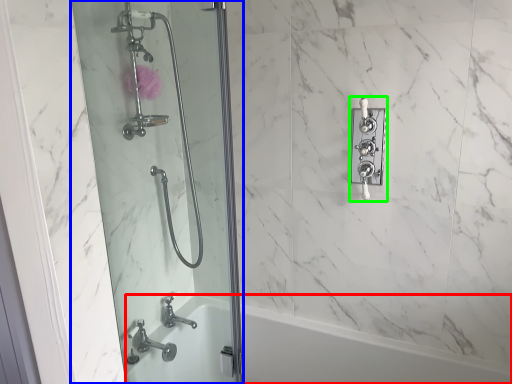
Question: Estimate the real-world distances between objects in this image. Which object is farther from bath (highlighted by a red box), screen door (highlighted by a blue box) or lock (highlighted by a green box)?

Choices:
 (A) screen door
 (B) lock

Answer: (B)